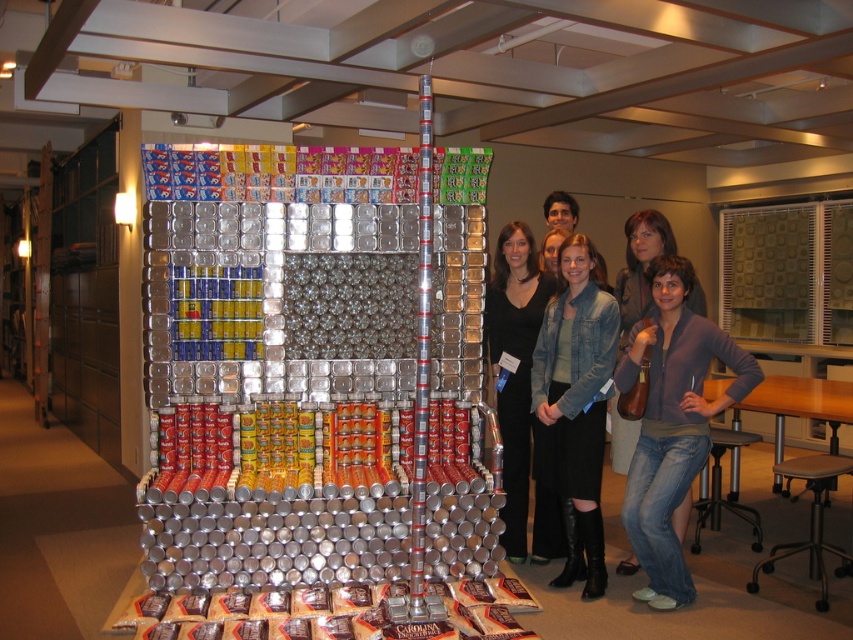
Is black dress at center bigger than denim jeans at lower right?

Correct, black dress at center is larger in size than denim jeans at lower right.

Which is more to the left, black dress at center or denim jeans at lower right?

From the viewer's perspective, black dress at center appears more on the left side.

Is point (512, 323) closer to viewer compared to point (697, 289)?

That is False.

Image resolution: width=853 pixels, height=640 pixels. I want to click on black dress at center, so click(517, 365).

Which is above, denim jacket at lower right or black dress at center?

black dress at center is above.

Is point (583, 596) more distant than point (541, 524)?

That is False.

What are the coordinates of `denim jacket at lower right` in the screenshot? It's located at (577, 403).

I want to click on denim jacket at lower right, so click(x=577, y=403).

Is denim jacket at lower right smaller than denim jeans at lower right?

No.

Which is in front, point (587, 497) or point (618, 344)?

Positioned in front is point (587, 497).

Identify the location of denim jacket at lower right. The image size is (853, 640). (577, 403).